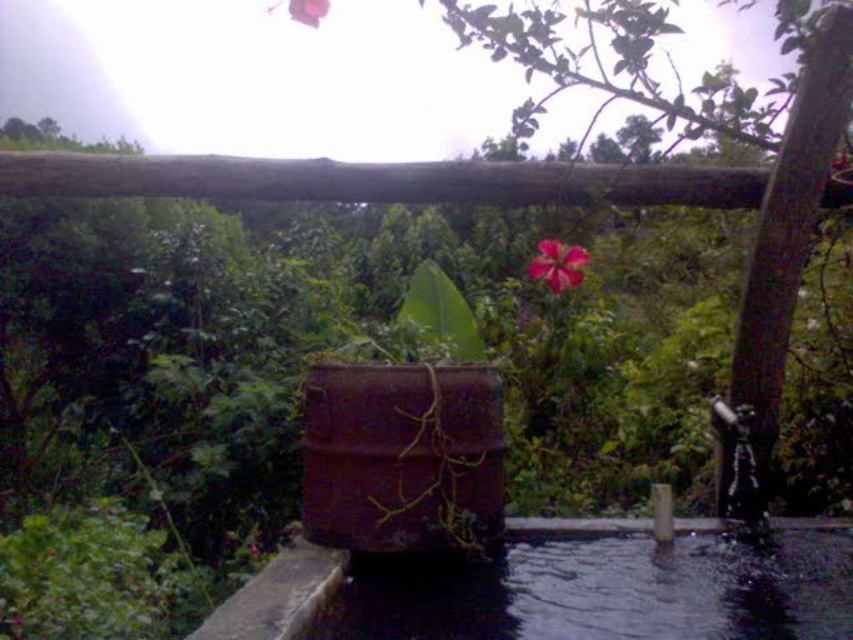
Can you confirm if clear water at bottom is thinner than pink matte flower at upper center?

Incorrect, clear water at bottom's width is not less than pink matte flower at upper center's.

Which is below, clear water at bottom or pink matte flower at upper center?

clear water at bottom

The height and width of the screenshot is (640, 853). I want to click on clear water at bottom, so click(608, 592).